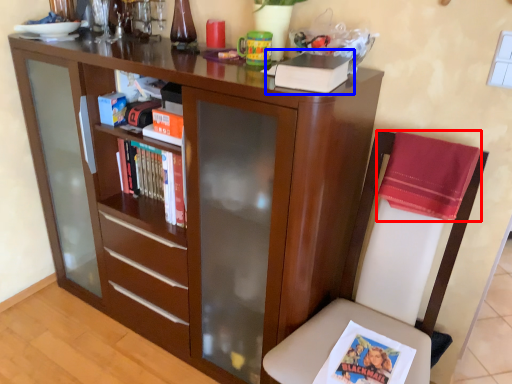
Question: Which object appears closest to the camera in this image, cloth (highlighted by a red box) or paperback book (highlighted by a blue box)?

Choices:
 (A) cloth
 (B) paperback book

Answer: (B)